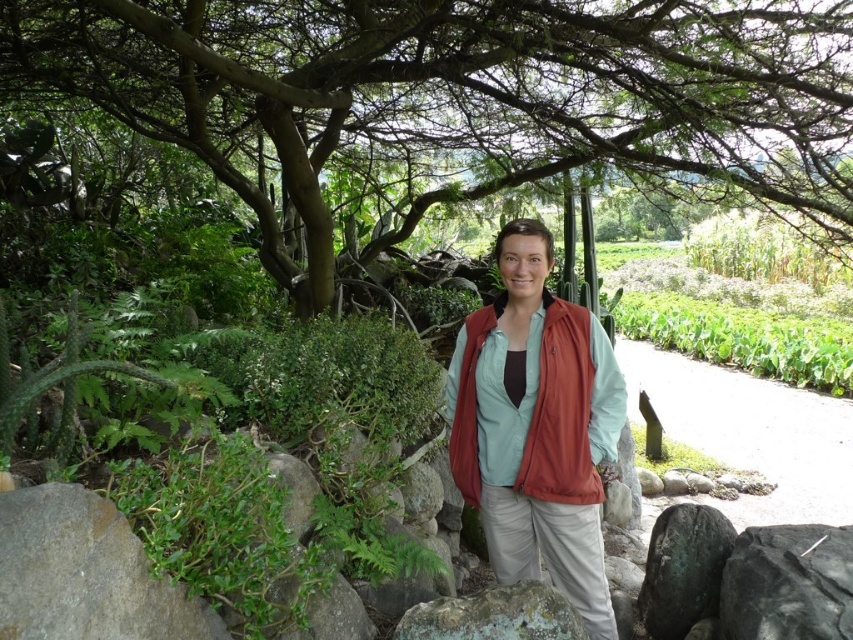
Is point (523, 90) less distant than point (802, 529)?

No.

Can you confirm if green leafy tree at center is positioned above black rock at lower right?

Yes, green leafy tree at center is above black rock at lower right.

What do you see at coordinates (457, 97) in the screenshot? The image size is (853, 640). I see `green leafy tree at center` at bounding box center [457, 97].

This screenshot has height=640, width=853. I want to click on green leafy tree at center, so click(x=457, y=97).

Between black rock at lower right and lichen-covered rock at lower center, which one has more height?

With more height is black rock at lower right.

Can you confirm if black rock at lower right is bigger than lichen-covered rock at lower center?

Indeed, black rock at lower right has a larger size compared to lichen-covered rock at lower center.

The height and width of the screenshot is (640, 853). I want to click on black rock at lower right, so click(788, 582).

Who is more forward, [680,131] or [561,384]?

Point [561,384] is in front.

Who is more distant from viewer, (285, 285) or (581, 385)?

The point (285, 285) is behind.

The image size is (853, 640). I want to click on green leafy tree at center, so click(x=457, y=97).